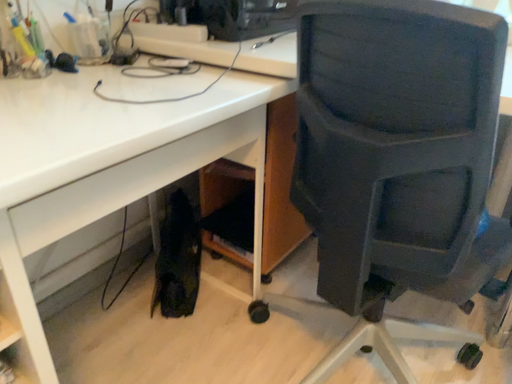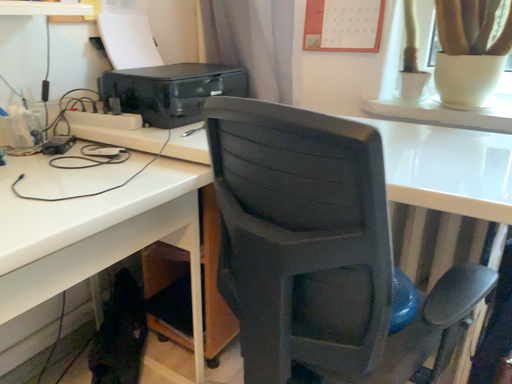
Question: Which way did the camera rotate in the video?

Choices:
 (A) rotated upward
 (B) rotated downward

Answer: (A)